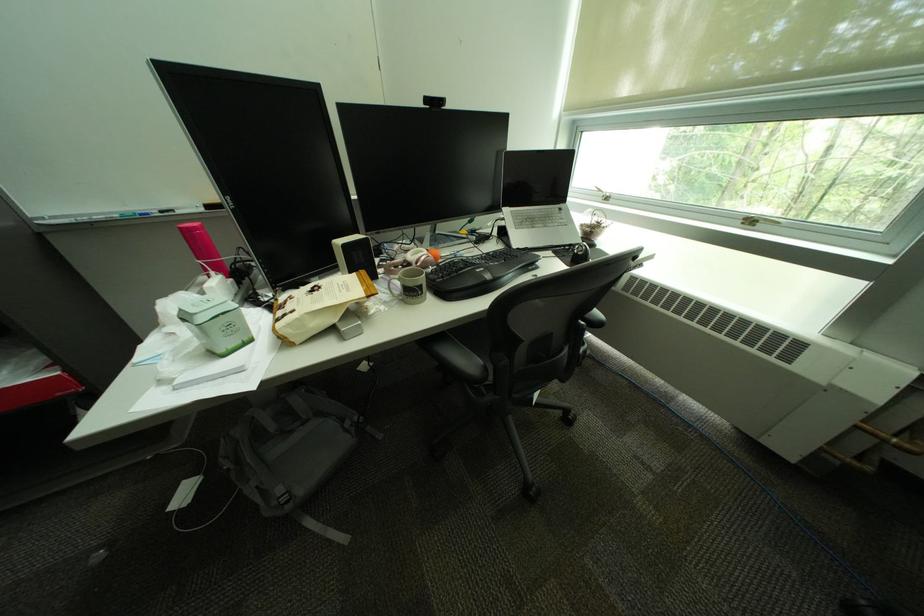
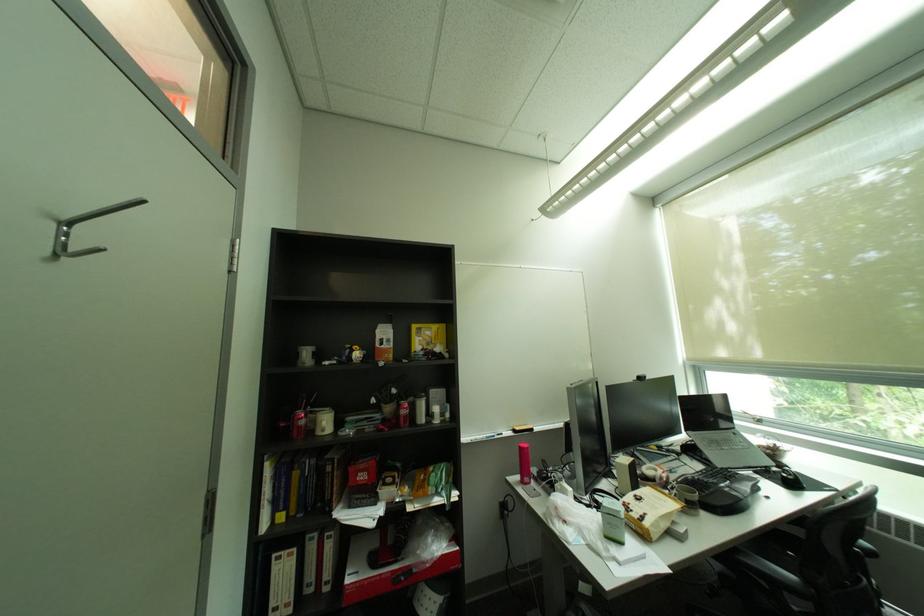
Where in the second image is the point corresponding to (x=499, y=254) from the first image?

(712, 472)